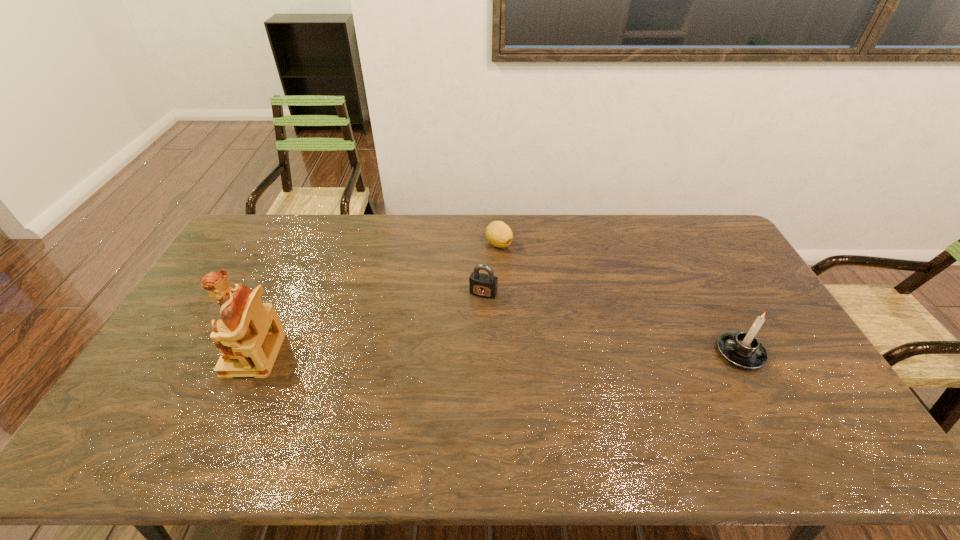
Identify the location of vacant point located 0.390m with a handle on the side of the third shortest object. The width and height of the screenshot is (960, 540). (580, 353).

Where is `free space located with a handle on the side of the third shortest object`? The width and height of the screenshot is (960, 540). free space located with a handle on the side of the third shortest object is located at coordinates (668, 353).

Identify the location of free space located with a handle on the side of the third shortest object. (609, 353).

Identify the location of vacant space located 0.360m at the stem end of the farthest object. (530, 329).

Locate an element on the screen. free space located 0.310m at the stem end of the farthest object is located at coordinates (525, 317).

This screenshot has height=540, width=960. Identify the location of free spot located at the stem end of the farthest object. (523, 310).

Image resolution: width=960 pixels, height=540 pixels. Find the location of `vacant space located on the front of the third tallest object near the keyhole`. vacant space located on the front of the third tallest object near the keyhole is located at coordinates (447, 371).

Identify the location of blank space located 0.350m on the front of the third tallest object near the keyhole. This screenshot has width=960, height=540. (440, 389).

I want to click on vacant area situated 0.150m on the front of the third tallest object near the keyhole, so click(x=464, y=334).

Locate an element on the screen. The height and width of the screenshot is (540, 960). object that is positioned at the far edge is located at coordinates (499, 234).